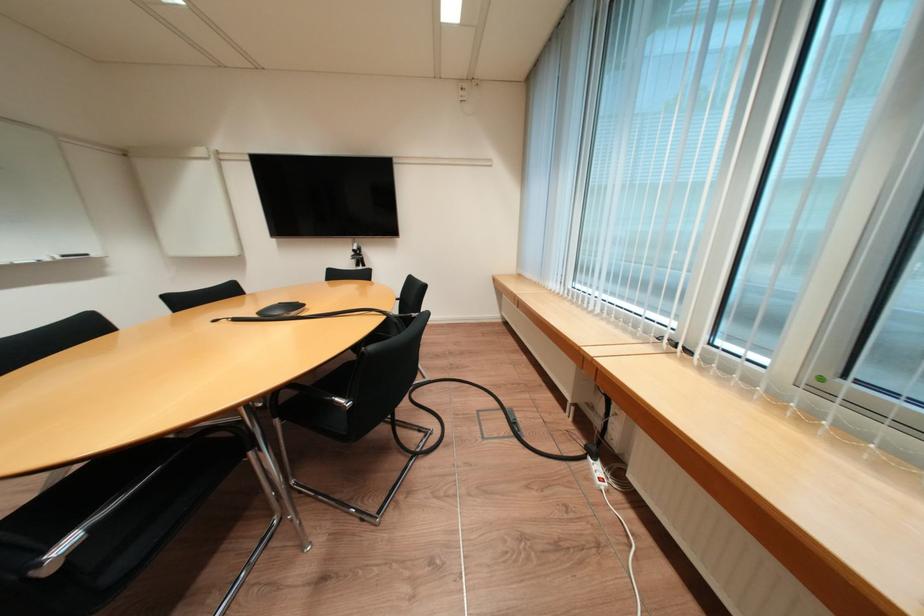
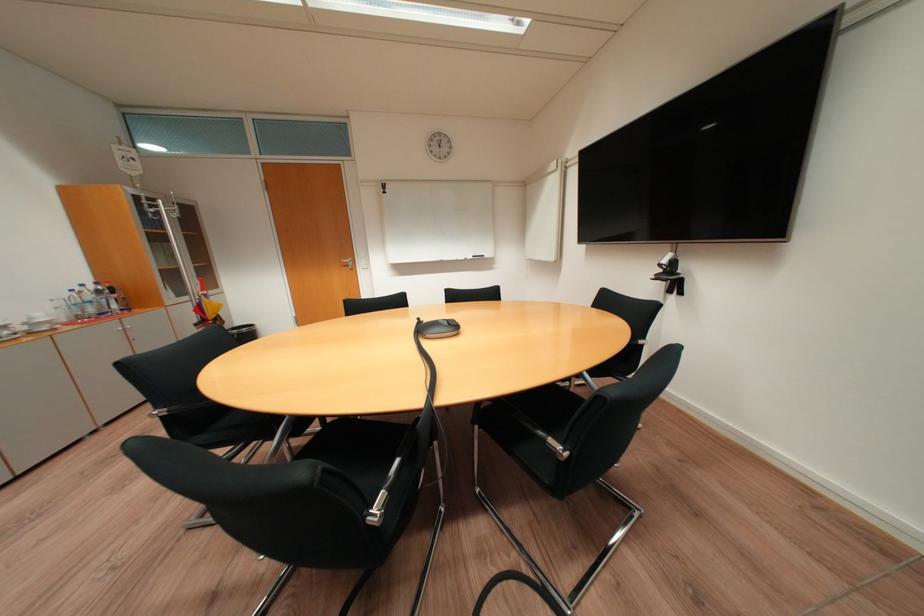
Where in the second image is the point corresponding to (x=363, y=249) from the first image?

(673, 262)